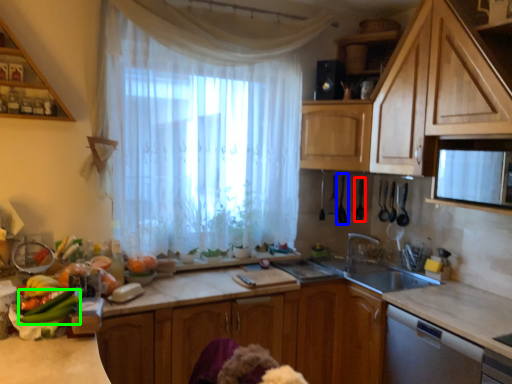
Question: Which object is the farthest from appliance (highlighted by a red box)? Choose among these: appliance (highlighted by a blue box) or vegetable (highlighted by a green box).

Choices:
 (A) appliance
 (B) vegetable

Answer: (B)